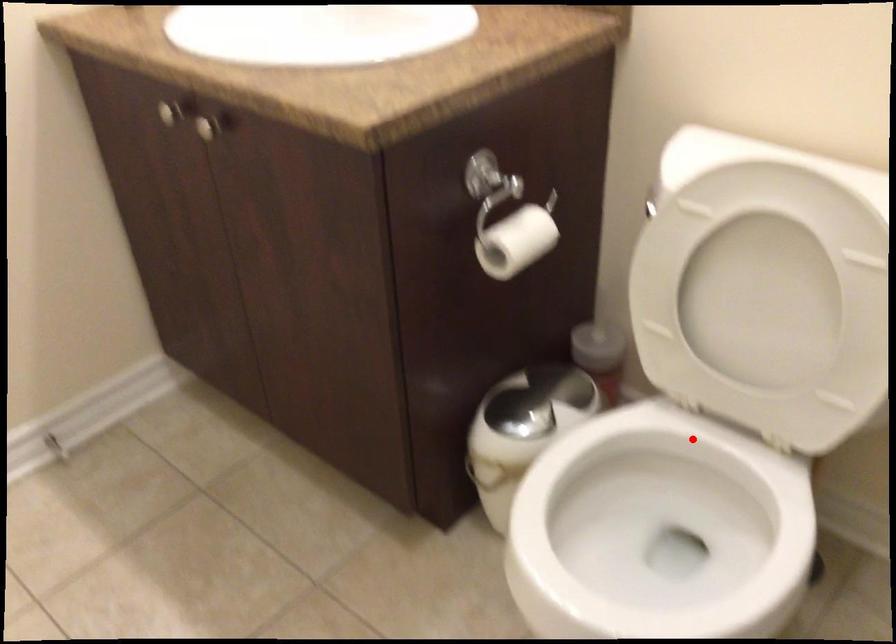
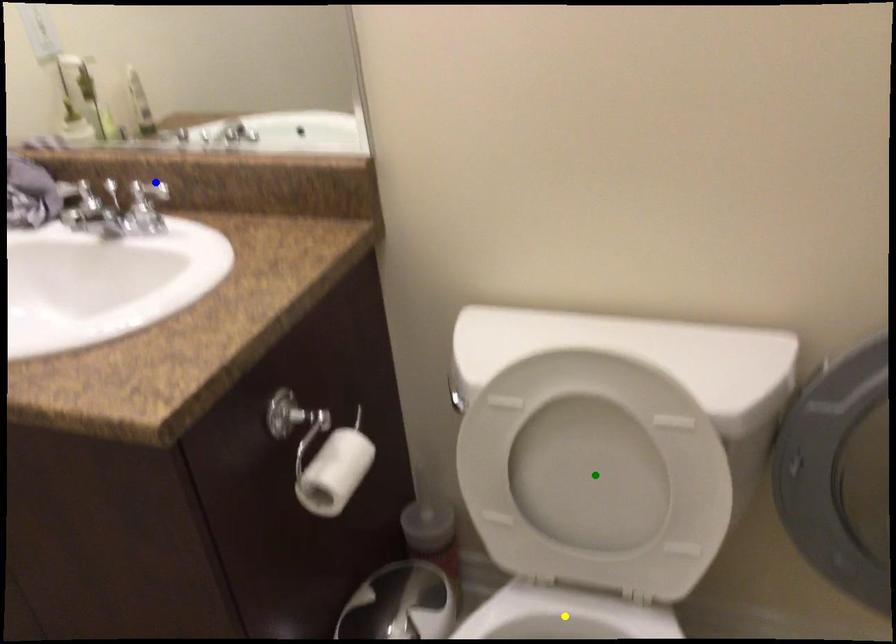
Question: I am providing you with two images of the same scene from different viewpoints. A red point is marked on the first image. You are given multiple points on the second image. In image 2, which mark is for the same physical point as the one in image 1?

Choices:
 (A) yellow point
 (B) blue point
 (C) green point

Answer: (A)